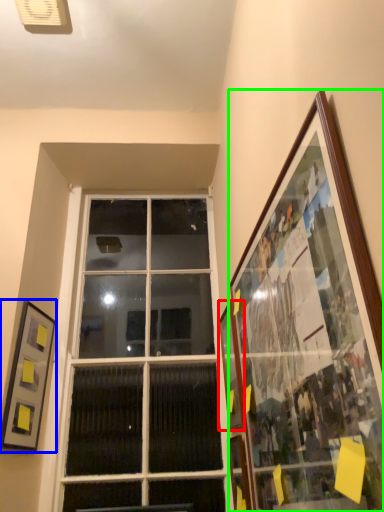
Question: Which is farther away from picture frame (highlighted by a red box)? picture frame (highlighted by a blue box) or picture frame (highlighted by a green box)?

Choices:
 (A) picture frame
 (B) picture frame

Answer: (A)